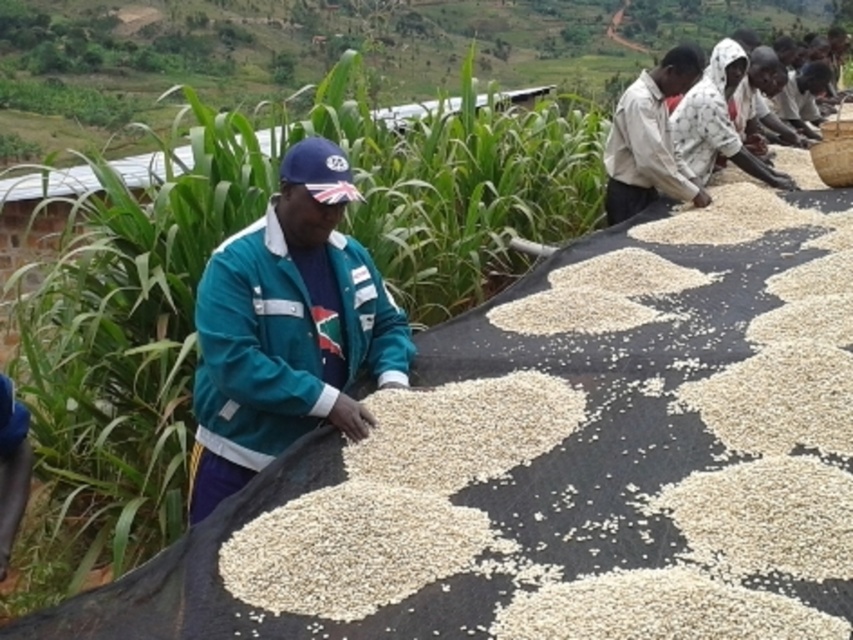
Question: Which point is farther to the camera?

Choices:
 (A) (206, 452)
 (B) (659, 164)

Answer: (B)

Question: Among these points, which one is farthest from the camera?

Choices:
 (A) (637, 132)
 (B) (331, 353)

Answer: (A)

Question: From the image, what is the correct spatial relationship of teal fabric jacket at center in relation to light brown cotton shirt at upper right?

Choices:
 (A) right
 (B) left

Answer: (B)

Question: From the image, what is the correct spatial relationship of teal fabric jacket at center in relation to light brown cotton shirt at upper right?

Choices:
 (A) below
 (B) above

Answer: (A)

Question: Is teal fabric jacket at center smaller than light brown cotton shirt at upper right?

Choices:
 (A) yes
 (B) no

Answer: (B)